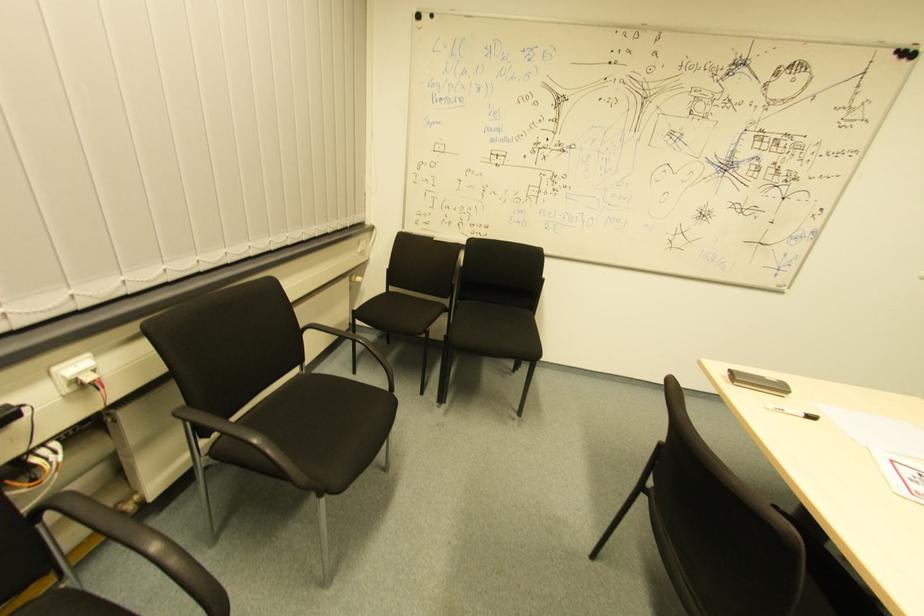
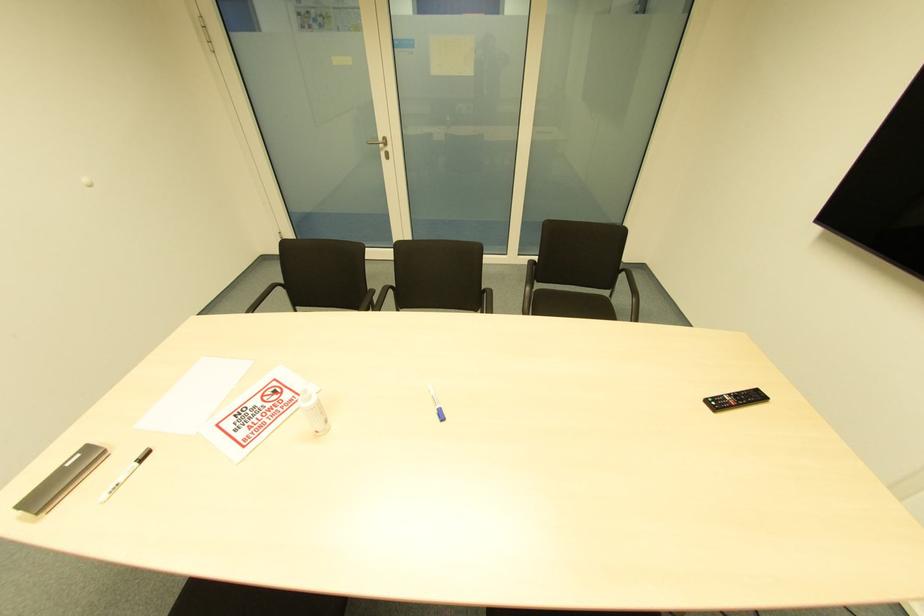
Based on the continuous images, in which direction is the camera rotating?

The camera rotated toward right-down.